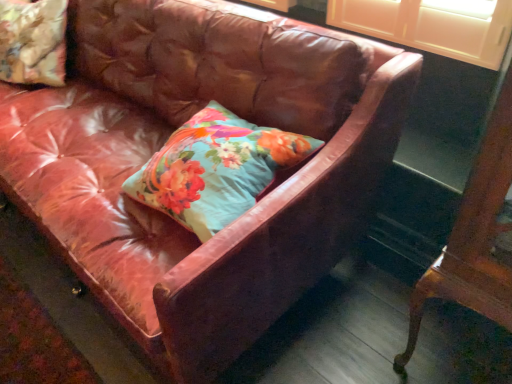
Question: From a real-world perspective, does floral fabric cushion at upper left, which ranks as the 2th pillow in right-to-left order, stand above mahogany wood table at right?

Choices:
 (A) no
 (B) yes

Answer: (B)

Question: Is floral fabric cushion at upper left, which appears as the first pillow when viewed from the top, thinner than mahogany wood table at right?

Choices:
 (A) yes
 (B) no

Answer: (B)

Question: Is floral fabric cushion at upper left, which appears as the first pillow when viewed from the back, oriented away from mahogany wood table at right?

Choices:
 (A) yes
 (B) no

Answer: (B)

Question: Would you say floral fabric cushion at upper left, which appears as the first pillow when viewed from the top, is outside mahogany wood table at right?

Choices:
 (A) yes
 (B) no

Answer: (A)

Question: Considering the relative sizes of floral fabric cushion at upper left, which ranks as the 2th pillow in right-to-left order, and mahogany wood table at right in the image provided, is floral fabric cushion at upper left, which ranks as the 2th pillow in right-to-left order, bigger than mahogany wood table at right?

Choices:
 (A) yes
 (B) no

Answer: (B)

Question: Is floral fabric cushion at upper left, which is the 2th pillow from bottom to top, wider than mahogany wood table at right?

Choices:
 (A) no
 (B) yes

Answer: (B)

Question: Is floral fabric cushion at upper left, which is counted as the 1th pillow, starting from the left, at the right side of floral fabric pillow at center, the second pillow from the back?

Choices:
 (A) yes
 (B) no

Answer: (B)

Question: Could you tell me if floral fabric cushion at upper left, which ranks as the 2th pillow in right-to-left order, is facing floral fabric pillow at center, acting as the first pillow starting from the front?

Choices:
 (A) no
 (B) yes

Answer: (A)

Question: Is floral fabric cushion at upper left, which ranks as the 2th pillow in right-to-left order, further to the viewer compared to floral fabric pillow at center, the 1th pillow viewed from the right?

Choices:
 (A) yes
 (B) no

Answer: (A)

Question: Is floral fabric cushion at upper left, which appears as the first pillow when viewed from the back, turned away from floral fabric pillow at center, the second pillow from the back?

Choices:
 (A) no
 (B) yes

Answer: (A)

Question: Can floral fabric pillow at center, the 1th pillow viewed from the right, be found inside floral fabric cushion at upper left, which appears as the first pillow when viewed from the back?

Choices:
 (A) yes
 (B) no

Answer: (B)

Question: Are floral fabric cushion at upper left, which is the 2th pillow from bottom to top, and floral fabric pillow at center, the 1th pillow viewed from the right, beside each other?

Choices:
 (A) yes
 (B) no

Answer: (B)

Question: Considering the relative sizes of floral fabric pillow at center, which appears as the first pillow when ordered from the bottom, and mahogany wood table at right in the image provided, is floral fabric pillow at center, which appears as the first pillow when ordered from the bottom, smaller than mahogany wood table at right?

Choices:
 (A) no
 (B) yes

Answer: (B)